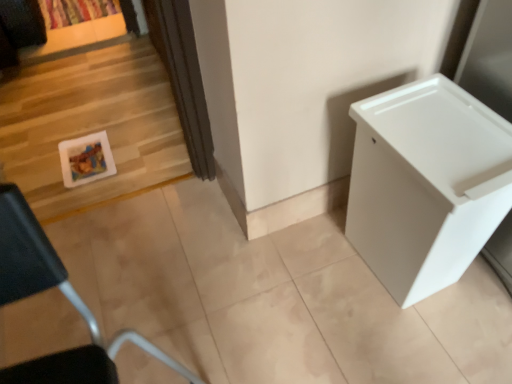
In order to face white plastic container at lower left, should I rotate leftwards or rightwards?

Turn left approximately 22.085 degrees to face it.

Measure the distance between point (10, 213) and camera.

They are 18.50 inches apart.

The height and width of the screenshot is (384, 512). What do you see at coordinates (76, 11) in the screenshot?
I see `multicolored fabric curtain at upper left` at bounding box center [76, 11].

At what (x,y) coordinates should I click in order to perform the action: click on white plastic changing table at right. Please return your answer as a coordinate pair (x, y). This screenshot has width=512, height=384. Looking at the image, I should click on (426, 184).

The image size is (512, 384). Describe the element at coordinates (426, 184) in the screenshot. I see `white plastic changing table at right` at that location.

Image resolution: width=512 pixels, height=384 pixels. In order to click on white plastic container at lower left in this screenshot , I will do `click(50, 273)`.

Would you say white plastic container at lower left is a long distance from white plastic changing table at right?

That's not correct — white plastic container at lower left is a little close to white plastic changing table at right.

From the image's perspective, is white plastic container at lower left above or below white plastic changing table at right?

white plastic container at lower left is below white plastic changing table at right.

Can you tell me how much white plastic container at lower left and white plastic changing table at right differ in facing direction?

There is a 84.2-degree angle between the facing directions of white plastic container at lower left and white plastic changing table at right.

Is the position of white plastic container at lower left more distant than that of white plastic changing table at right?

No.

Is white plastic changing table at right facing towards white glossy picture frame at left?

No, white plastic changing table at right is not facing towards white glossy picture frame at left.

Is white plastic changing table at right inside the boundaries of white glossy picture frame at left, or outside?

white plastic changing table at right lies outside white glossy picture frame at left.

This screenshot has height=384, width=512. Identify the location of changing table lying below the white glossy picture frame at left (from the image's perspective). (426, 184).

Which of these two, white plastic changing table at right or white glossy picture frame at left, is wider?

Wider between the two is white glossy picture frame at left.

Which point is more forward, (76, 156) or (156, 356)?

Point (156, 356)

Relative to white plastic container at lower left, is white glossy picture frame at left in front or behind?

Visually, white glossy picture frame at left is located behind white plastic container at lower left.

Is white glossy picture frame at left positioned far away from white plastic container at lower left?

That's not correct — white glossy picture frame at left is a little close to white plastic container at lower left.

From the image's perspective, is white plastic container at lower left above or below white glossy picture frame at left?

From the image's perspective, white plastic container at lower left appears below white glossy picture frame at left.

From a real-world perspective, which object stands above the other?

white plastic container at lower left, from a real-world perspective.

Is white plastic container at lower left oriented towards white glossy picture frame at left?

No, white plastic container at lower left is not aimed at white glossy picture frame at left.

Could you tell me if white plastic changing table at right is turned towards white plastic container at lower left?

Yes, white plastic changing table at right is facing white plastic container at lower left.

Does white plastic changing table at right have a lesser width compared to white plastic container at lower left?

In fact, white plastic changing table at right might be wider than white plastic container at lower left.

Can you see white plastic changing table at right touching white plastic container at lower left?

white plastic changing table at right is not next to white plastic container at lower left, and they're not touching.

From the image's perspective, which one is positioned lower, white plastic changing table at right or white plastic container at lower left?

white plastic container at lower left, from the image's perspective.

Is white plastic container at lower left a part of multicolored fabric curtain at upper left?

No, white plastic container at lower left is not inside multicolored fabric curtain at upper left.

Is the surface of multicolored fabric curtain at upper left in direct contact with white plastic container at lower left?

multicolored fabric curtain at upper left and white plastic container at lower left are clearly separated.

Who is taller, multicolored fabric curtain at upper left or white plastic container at lower left?

With more height is white plastic container at lower left.

Considering the points (63, 25) and (4, 185), which point is behind, point (63, 25) or point (4, 185)?

Positioned behind is point (63, 25).

From a real-world perspective, is white plastic container at lower left physically above multicolored fabric curtain at upper left?

Correct, in the physical world, white plastic container at lower left is higher than multicolored fabric curtain at upper left.

Is white plastic container at lower left looking in the opposite direction of multicolored fabric curtain at upper left?

Yes, white plastic container at lower left is positioned with its back facing multicolored fabric curtain at upper left.

Is white plastic container at lower left bigger or smaller than multicolored fabric curtain at upper left?

Considering their sizes, white plastic container at lower left takes up more space than multicolored fabric curtain at upper left.

Locate an element on the screen. The height and width of the screenshot is (384, 512). changing table that appears behind the white plastic container at lower left is located at coordinates (426, 184).

Find the location of a particular element. This screenshot has height=384, width=512. picture frame on the left of white plastic changing table at right is located at coordinates (86, 159).

Which object lies nearer to the anchor point multicolored fabric curtain at upper left, white plastic changing table at right or white glossy picture frame at left?

white glossy picture frame at left is positioned closer to the anchor multicolored fabric curtain at upper left.

Based on their spatial positions, is multicolored fabric curtain at upper left or white plastic container at lower left further from white plastic changing table at right?

Based on the image, multicolored fabric curtain at upper left appears to be further to white plastic changing table at right.

From the image, which object appears to be farther from multicolored fabric curtain at upper left, white glossy picture frame at left or white plastic changing table at right?

The object further to multicolored fabric curtain at upper left is white plastic changing table at right.

Which object lies nearer to the anchor point white glossy picture frame at left, multicolored fabric curtain at upper left or white plastic container at lower left?

Based on the image, white plastic container at lower left appears to be nearer to white glossy picture frame at left.

Looking at this image, considering their positions, is white plastic container at lower left positioned further to multicolored fabric curtain at upper left than white glossy picture frame at left?

Based on the image, white plastic container at lower left appears to be further to multicolored fabric curtain at upper left.

Estimate the real-world distances between objects in this image. Which object is closer to multicolored fabric curtain at upper left, white plastic container at lower left or white plastic changing table at right?

Based on the image, white plastic container at lower left appears to be nearer to multicolored fabric curtain at upper left.

When comparing their distances from white plastic changing table at right, does white glossy picture frame at left or multicolored fabric curtain at upper left seem further?

multicolored fabric curtain at upper left is further to white plastic changing table at right.

Which object lies further to the anchor point white plastic changing table at right, multicolored fabric curtain at upper left or white glossy picture frame at left?

Based on the image, multicolored fabric curtain at upper left appears to be further to white plastic changing table at right.

Where is `picture frame between white plastic changing table at right and multicolored fabric curtain at upper left along the z-axis`? picture frame between white plastic changing table at right and multicolored fabric curtain at upper left along the z-axis is located at coordinates (86, 159).

This screenshot has width=512, height=384. Identify the location of picture frame located between white plastic container at lower left and multicolored fabric curtain at upper left in the depth direction. (86, 159).

Locate an element on the screen. changing table between white plastic container at lower left and multicolored fabric curtain at upper left in the front-back direction is located at coordinates (426, 184).

Find the location of a particular element. The height and width of the screenshot is (384, 512). changing table between white plastic container at lower left and white glossy picture frame at left along the z-axis is located at coordinates (426, 184).